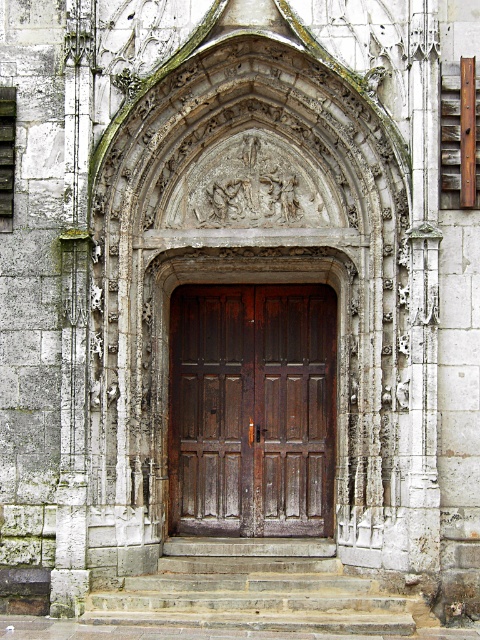
Consider the image. You are a tour guide explaining the entrance to visitors. You mention the dark brown wood door at center and the stone steps at center. Which one is located higher up?

The dark brown wood door at center is positioned over the stone steps at center, so it is higher up.

You are a painter standing at the base of the stone steps at center, preparing to paint the dark brown wood door at center. Can you paint the entire door without needing to move your position, considering their sizes?

The dark brown wood door at center is much taller than the stone steps at center. Since the door is taller, you would need to move your position to paint the entire door as the steps are shorter and may not provide enough elevation.